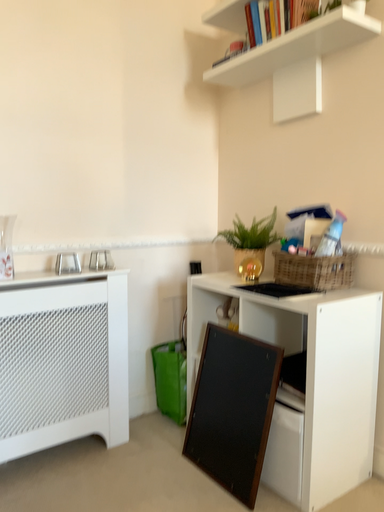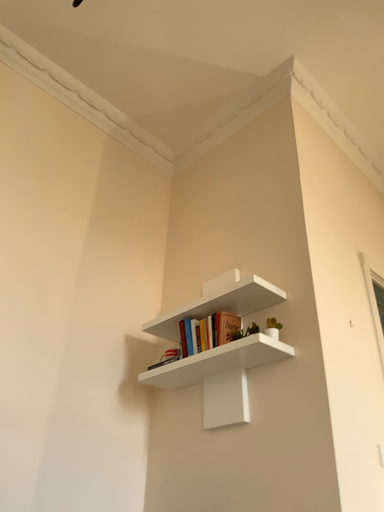
Question: Which way did the camera rotate in the video?

Choices:
 (A) rotated upward
 (B) rotated downward

Answer: (A)